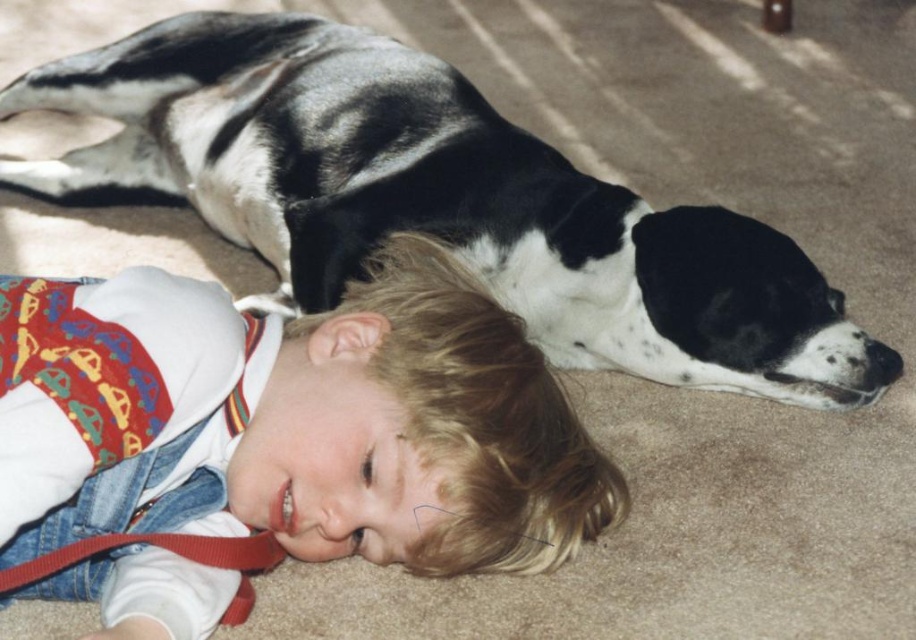
You are a photographer taking a picture of the child and the dog. You want to ensure the denim overalls at lower left are visible in the frame. Where should you position the camera relative to the scene?

The denim overalls at lower left are located at point (x=292, y=420). To ensure they are visible in the frame, position the camera so that it captures the lower left area of the scene.

You are a photographer trying to capture a closeup of the black and white fur dog at upper center without moving the denim overalls at lower left. Can you adjust your position to focus on the dog while keeping the overalls in the frame?

The denim overalls at lower left is below the black and white fur dog at upper center, so you can move your position slightly upwards while keeping the overalls in the lower part of the frame to focus on the dog.

Looking at this image, you are a photographer setting up a shot of the child and the dog. You want to ensure the denim overalls at lower left and the black and white fur dog at upper center are both clearly visible. Which object should you focus on first to ensure both are in focus?

The denim overalls at lower left is in front of the black and white fur dog at upper center. To ensure both are in focus, focus on the denim overalls at lower left first since it is closer to the camera, and the depth of field may naturally include the dog behind it.